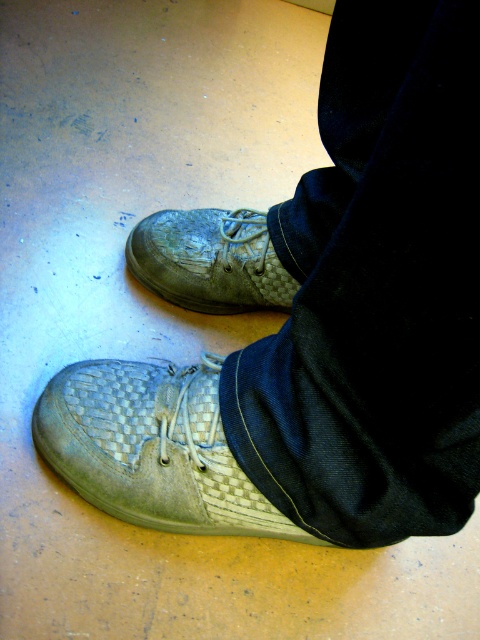
Question: Among these objects, which one is farthest from the camera?

Choices:
 (A) woven fabric shoe at lower center
 (B) worn leather shoe at center

Answer: (B)

Question: Is woven fabric shoe at lower center bigger than worn leather shoe at center?

Choices:
 (A) no
 (B) yes

Answer: (B)

Question: Considering the relative positions of woven fabric shoe at lower center and worn leather shoe at center in the image provided, where is woven fabric shoe at lower center located with respect to worn leather shoe at center?

Choices:
 (A) above
 (B) below

Answer: (B)

Question: Is woven fabric shoe at lower center to the right of worn leather shoe at center from the viewer's perspective?

Choices:
 (A) no
 (B) yes

Answer: (A)

Question: Which point appears closest to the camera in this image?

Choices:
 (A) (229, 312)
 (B) (216, 509)

Answer: (B)